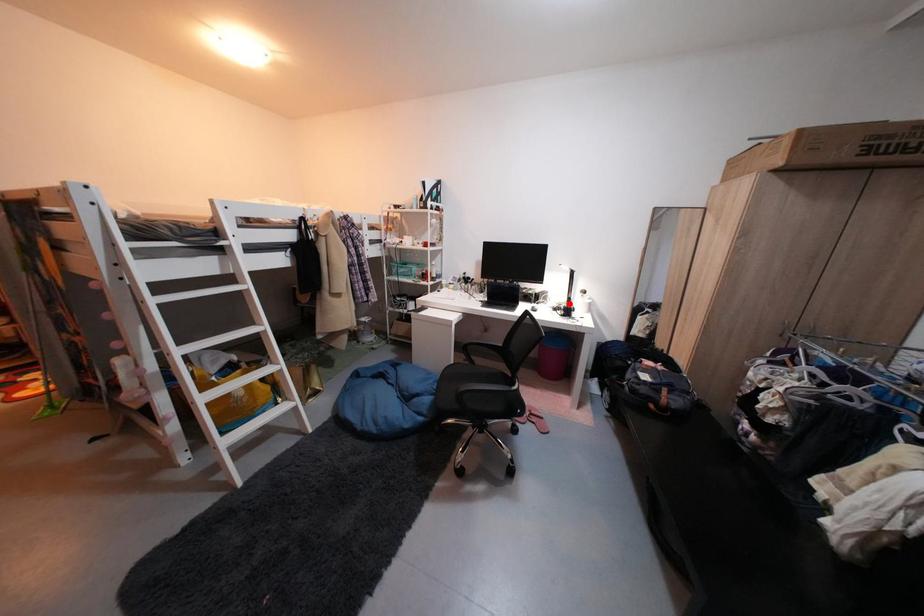
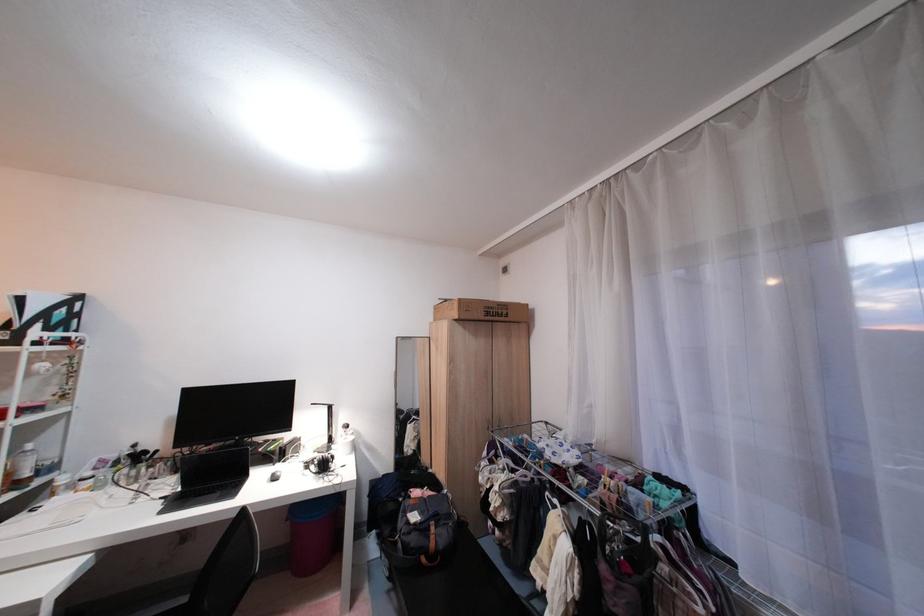
Find the pixel in the second image that matches the highlighted location in the first image.

(326, 450)